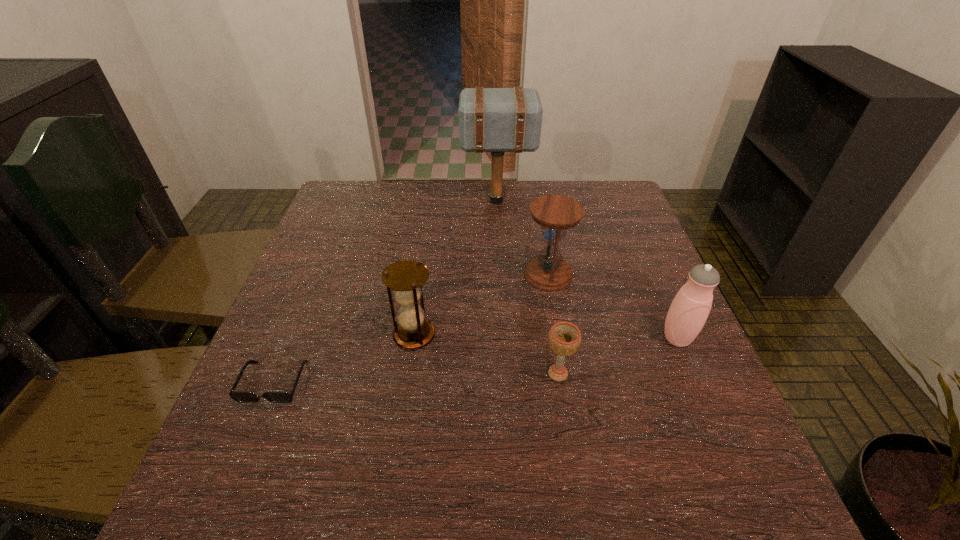
The height and width of the screenshot is (540, 960). Find the location of `vacant space located 0.280m on the striking surface of the farthest object`. vacant space located 0.280m on the striking surface of the farthest object is located at coordinates (368, 201).

Find the location of a particular element. vacant area situated 0.170m on the striking surface of the farthest object is located at coordinates (405, 201).

This screenshot has height=540, width=960. I want to click on vacant area situated on the striking surface of the farthest object, so click(428, 201).

You are a GUI agent. You are given a task and a screenshot of the screen. Output one action in this format:
    pyautogui.click(x=<x>, y=<y>)
    Task: Click on the free location located on the back of the rightmost object
    The height and width of the screenshot is (540, 960).
    Given the screenshot: What is the action you would take?
    pyautogui.click(x=640, y=253)

Locate an element on the screen. The image size is (960, 540). vacant space located 0.170m on the right of the fifth nearest object is located at coordinates (642, 275).

The image size is (960, 540). What are the coordinates of `vacant area situated on the front of the second object from left to right` in the screenshot? It's located at (405, 400).

Locate an element on the screen. The image size is (960, 540). vacant space located 0.050m on the back of the second shortest object is located at coordinates (553, 342).

Identify the location of vacant space located on the front-facing side of the sunglasses. The height and width of the screenshot is (540, 960). (245, 453).

Locate an element on the screen. object that is at the far edge is located at coordinates (497, 120).

Where is `object at the left edge`? object at the left edge is located at coordinates (239, 396).